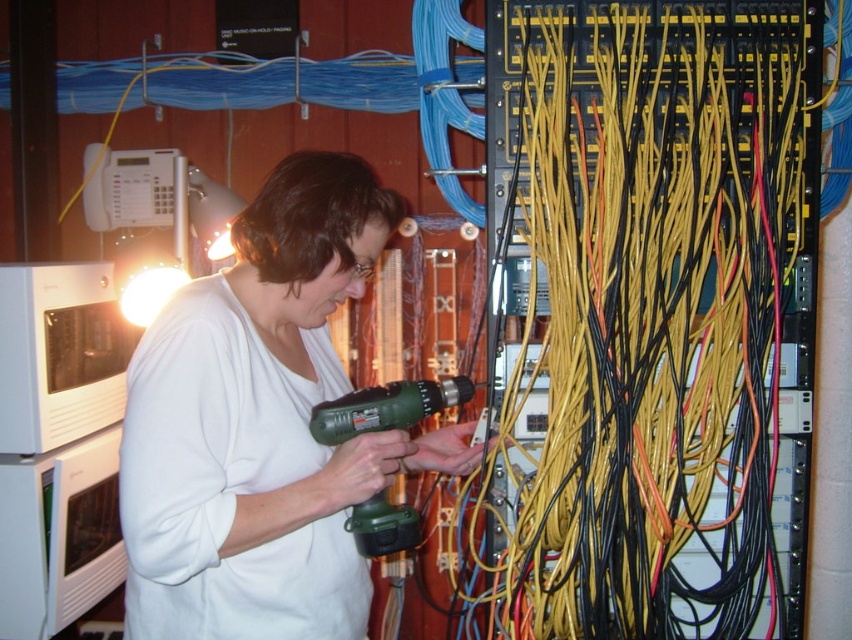
This screenshot has width=852, height=640. I want to click on white matte shirt at center, so click(x=262, y=426).

Can you confirm if white matte shirt at center is positioned below green plastic drill at center?

Incorrect, white matte shirt at center is not positioned below green plastic drill at center.

What are the coordinates of `white matte shirt at center` in the screenshot? It's located at point(262,426).